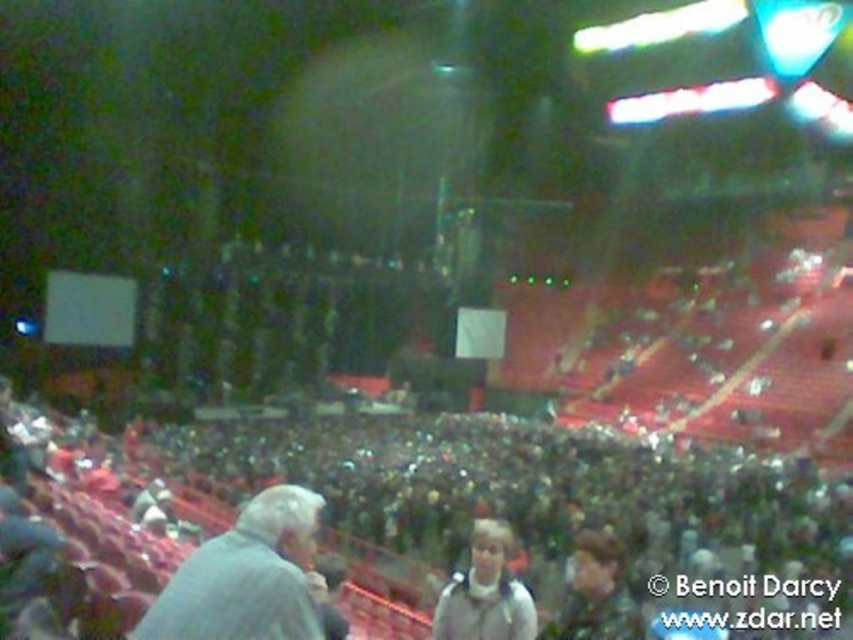
From the picture: You are standing at the point marked as point (126, 564) in the arena. What is the immediate environment around you based on the scene description?

The immediate environment around point (126, 564) is the dark gray crowd at center, indicating you are surrounded by densely packed spectators in the central area of the arena.

You are a photographer standing at the back of the arena with a camera that has a maximum zoom range of 20 meters. You want to take a clear photo of the white fleece jacket at center. Can your camera zoom in enough to capture the jacket clearly?

The white fleece jacket at center is 24.73 meters away from the camera. Since the camera can only zoom up to 20 meters, it cannot capture the jacket clearly at that distance.

You are sitting in the front row of the arena and notice two people in the crowd ahead of you. One is wearing a white fleece jacket at center and the other a light gray hoodie at center. Which person is closer to you?

The white fleece jacket at center is closer to you because it is positioned under the light gray hoodie at center, indicating it is in a lower row of seating.